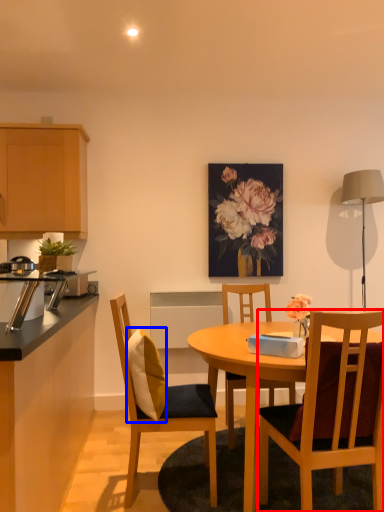
Question: Among these objects, which one is farthest to the camera, chair (highlighted by a red box) or pillow (highlighted by a blue box)?

Choices:
 (A) chair
 (B) pillow

Answer: (B)